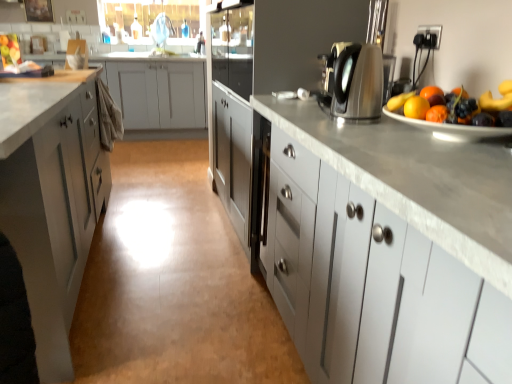
Question: Looking at their shapes, would you say white matte cabinet at left, the first cabinetry from the back, is wider or thinner than satin silver kettle at upper right?

Choices:
 (A) wide
 (B) thin

Answer: (A)

Question: From their relative heights in the image, would you say white matte cabinet at left, marked as the first cabinetry in a left-to-right arrangement, is taller or shorter than satin silver kettle at upper right?

Choices:
 (A) short
 (B) tall

Answer: (B)

Question: Based on their relative distances, which object is nearer to the satin silver kettle at upper right?

Choices:
 (A) white matte cabinet at right, arranged as the first cabinetry when viewed from the front
 (B) white matte cabinet at left, arranged as the second cabinetry when viewed from the front
 (C) shiny ceramic plate at right
 (D) white glossy sink at upper center
 (E) white matte cabinet at left, the 3th cabinetry positioned from the front

Answer: (C)

Question: Based on their relative distances, which object is farther from the satin nickel faucet at upper center?

Choices:
 (A) white matte cabinet at right, placed as the 3th cabinetry when sorted from back to front
 (B) white matte cabinet at left, the first cabinetry from the back
 (C) shiny ceramic plate at right
 (D) satin silver kettle at upper right
 (E) white matte cabinet at left, positioned as the 2th cabinetry in right-to-left order

Answer: (A)